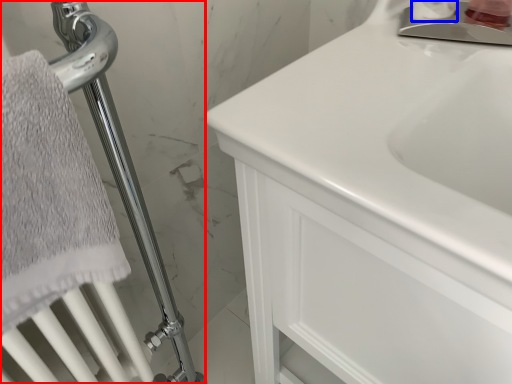
Question: Which point is closer to the camera, shower (highlighted by a red box) or toiletry (highlighted by a blue box)?

Choices:
 (A) shower
 (B) toiletry

Answer: (A)